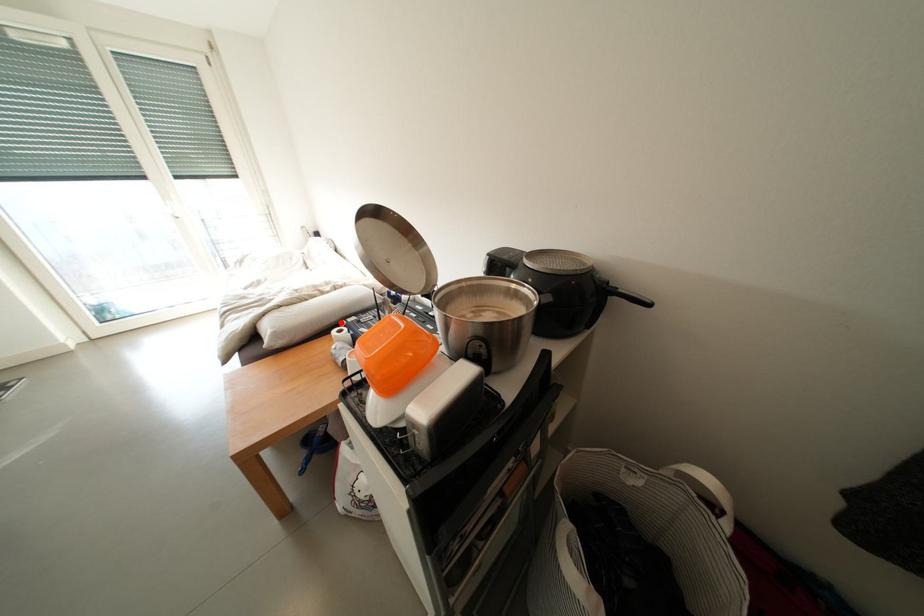
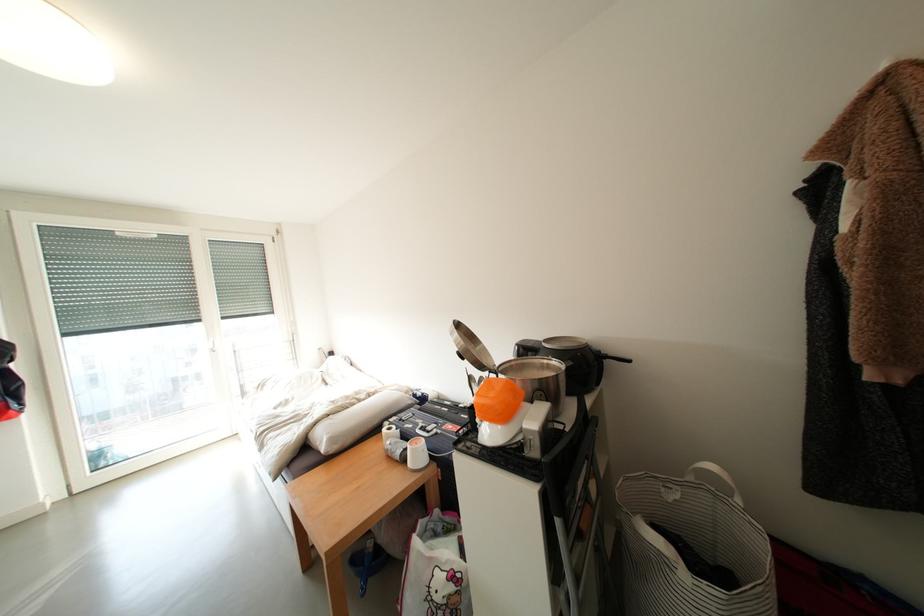
The point at the highlighted location is marked in the first image. Where is the corresponding point in the second image?

(383, 426)